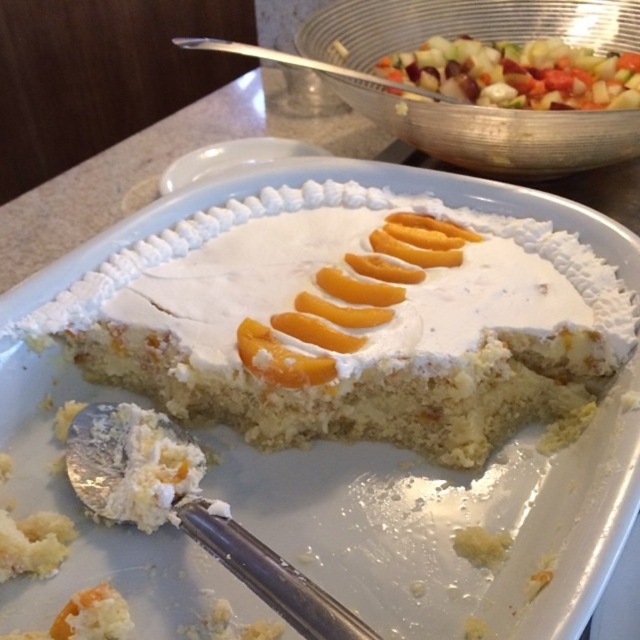
Question: Does white creamy cake at center lie in front of multicolored diced vegetables at upper right?

Choices:
 (A) no
 (B) yes

Answer: (B)

Question: Where is white creamy frosting at center located in relation to multicolored diced vegetables at upper right in the image?

Choices:
 (A) above
 (B) below

Answer: (B)

Question: Which point is closer to the camera?

Choices:
 (A) white creamy frosting at center
 (B) white creamy cake at center
 (C) multicolored diced vegetables at upper right

Answer: (B)

Question: Which of the following is the farthest from the observer?

Choices:
 (A) (374, 404)
 (B) (499, 58)
 (C) (262, 316)

Answer: (B)

Question: Which point is farther from the camera taking this photo?

Choices:
 (A) (436, 288)
 (B) (305, 256)
 (C) (449, 49)

Answer: (C)

Question: Is white creamy cake at center above multicolored diced vegetables at upper right?

Choices:
 (A) yes
 (B) no

Answer: (B)